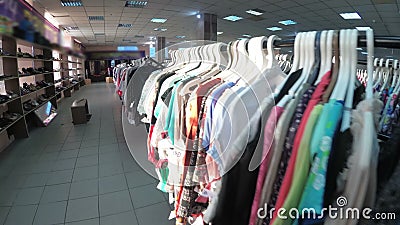
You are a GUI agent. You are given a task and a screenshot of the screen. Output one action in this format:
    pyautogui.click(x=<x>, y=<y>)
    Task: Click on the clothes rack
    This screenshot has width=400, height=225.
    Given the screenshot: What is the action you would take?
    pyautogui.click(x=284, y=46), pyautogui.click(x=389, y=44)